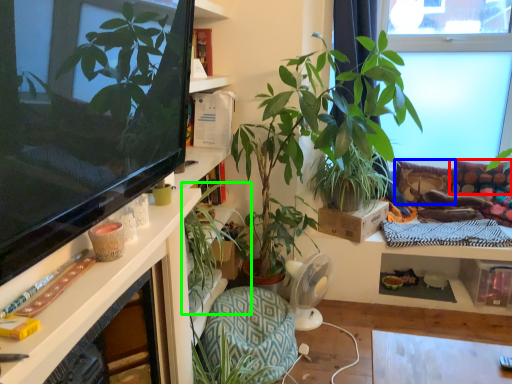
Question: Which is nearer to the pillow (highlighted by a red box)? pillow (highlighted by a blue box) or houseplant (highlighted by a green box).

Choices:
 (A) pillow
 (B) houseplant

Answer: (A)